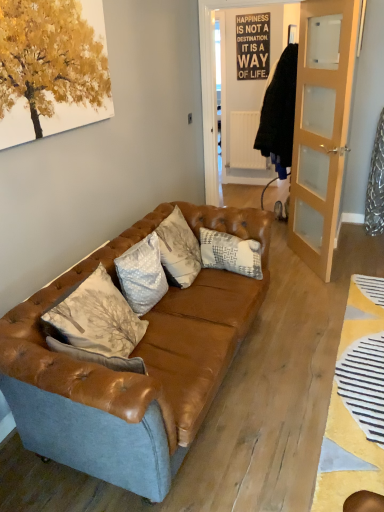
Identify the location of vacant space in front of light brown wooden door at right. This screenshot has height=512, width=384. (308, 288).